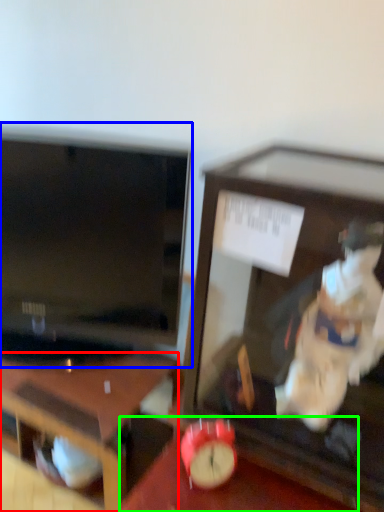
Question: Which object is the farthest from desk (highlighted by a red box)? Choose among these: television (highlighted by a blue box) or table (highlighted by a green box).

Choices:
 (A) television
 (B) table

Answer: (A)